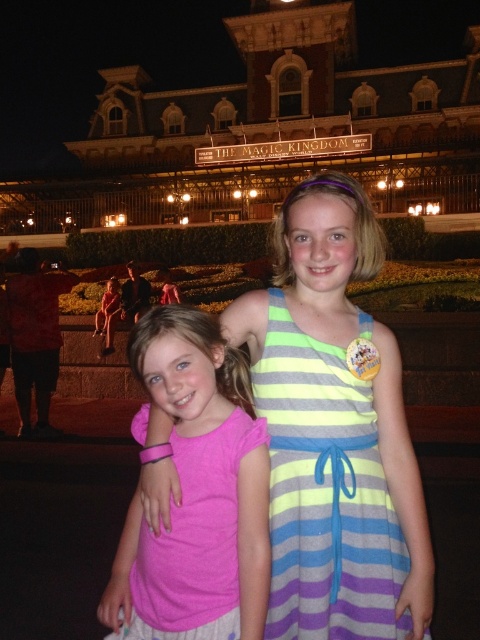
Can you confirm if pink fabric dress at center is taller than pink fabric shirt at center?

Yes, pink fabric dress at center is taller than pink fabric shirt at center.

In the scene shown: Can you confirm if pink fabric dress at center is positioned below pink fabric shirt at center?

No.

Is point (291, 358) farther from camera compared to point (255, 516)?

Yes, point (291, 358) is farther from viewer.

The width and height of the screenshot is (480, 640). I want to click on pink fabric dress at center, so click(x=335, y=429).